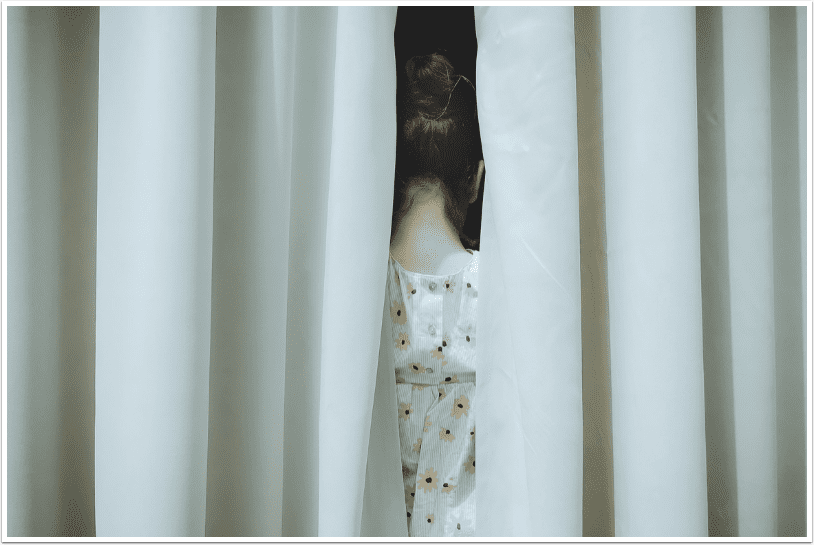
This screenshot has height=545, width=814. I want to click on shadowed area where curtain curves inward, so click(719, 429), click(597, 438), click(304, 423), click(79, 431), click(219, 414), click(790, 421).